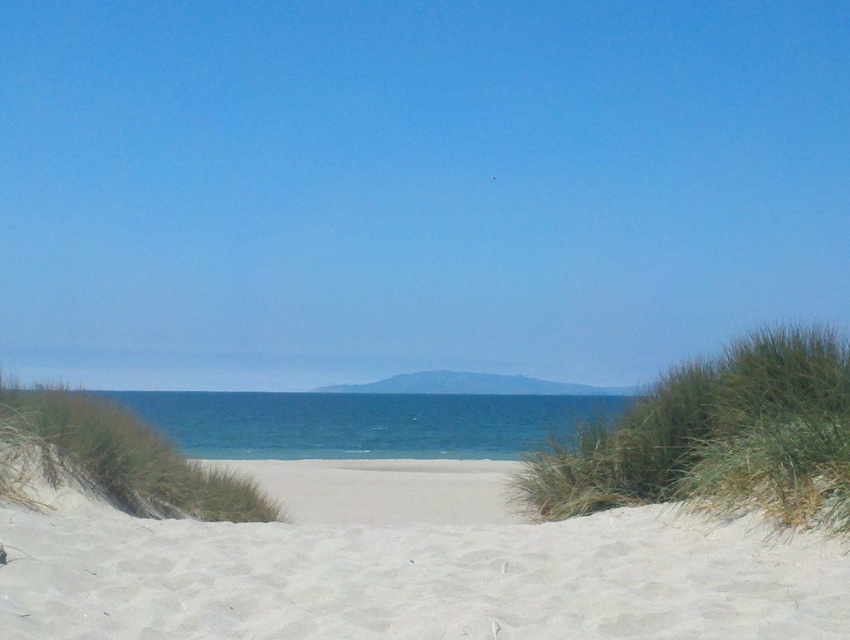
Consider the image. You are standing at the beach and see two points marked in the image. Which point is closer to you, point (473, 612) or point (125, 403)?

Point (473, 612) is closer to the camera than point (125, 403), so the point closer to you is point (473, 612).

From the picture: You are standing on the white sandy beach at center and looking towards the blue water at center. Which surface is lower in elevation between the two?

The white sandy beach at center has a lesser height compared to the blue water at center, so the white sandy beach at center is lower in elevation.